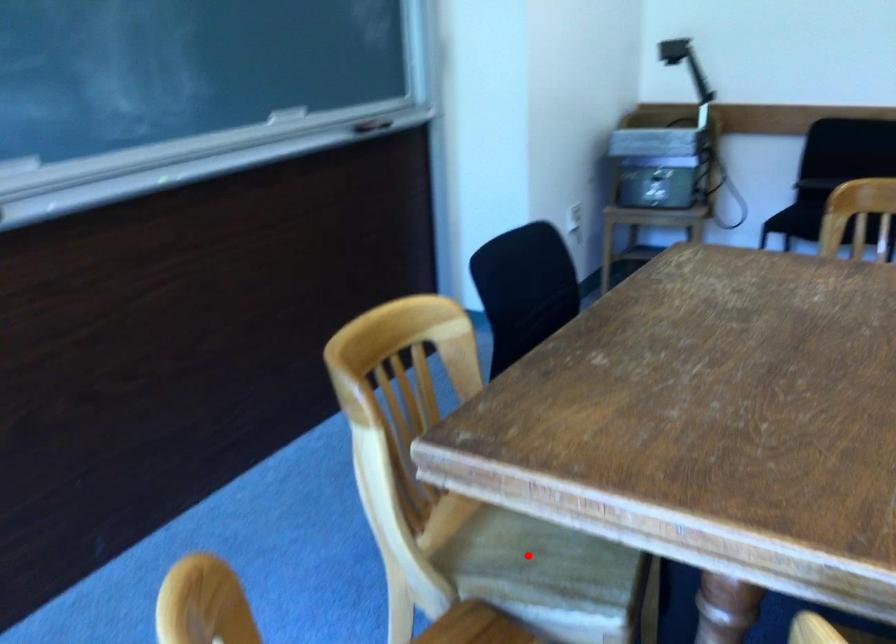
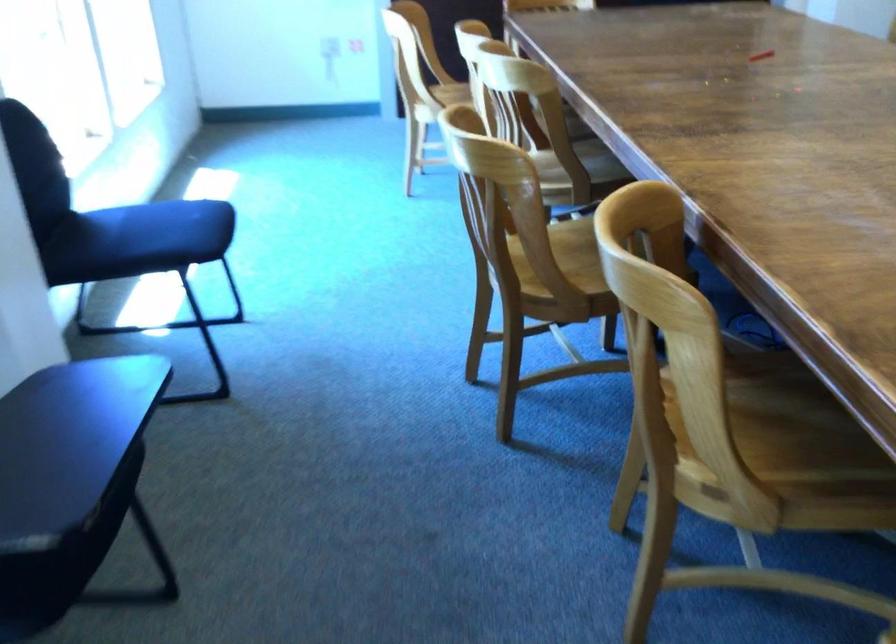
Question: I am providing you with two images of the same scene from different viewpoints. A red point is marked on the first image. At the location where the point appears in image 1, is it still visible in image 2?

Choices:
 (A) Yes
 (B) No

Answer: (B)